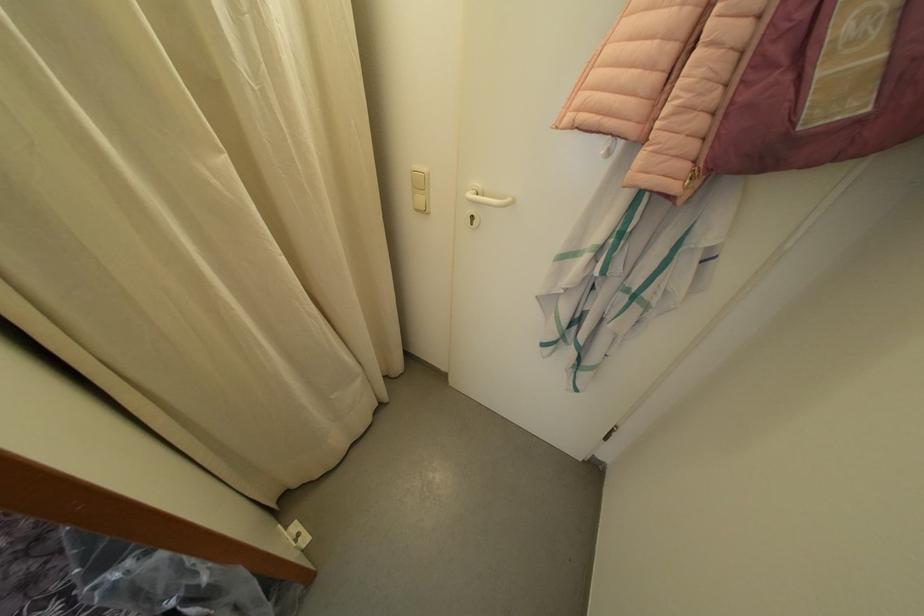
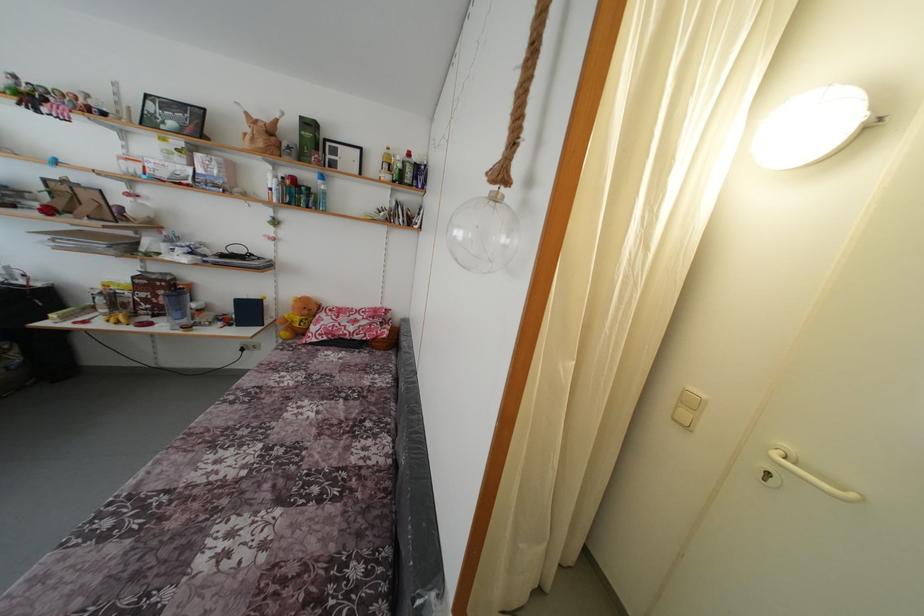
In the second image, find the point that corresponds to (514,206) in the first image.

(859, 501)